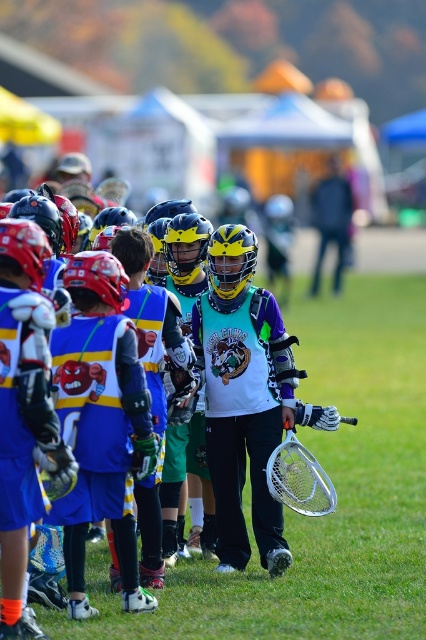
Describe the element at coordinates (100, 420) in the screenshot. The width and height of the screenshot is (426, 640). I see `matte blue jersey at center` at that location.

Between matte blue jersey at center and matte yellow helmet at center, which one is positioned higher?

matte yellow helmet at center is higher up.

Between point (80, 547) and point (152, 387), which one is positioned behind?

Point (152, 387)

Locate an element on the screen. matte blue jersey at center is located at coordinates (100, 420).